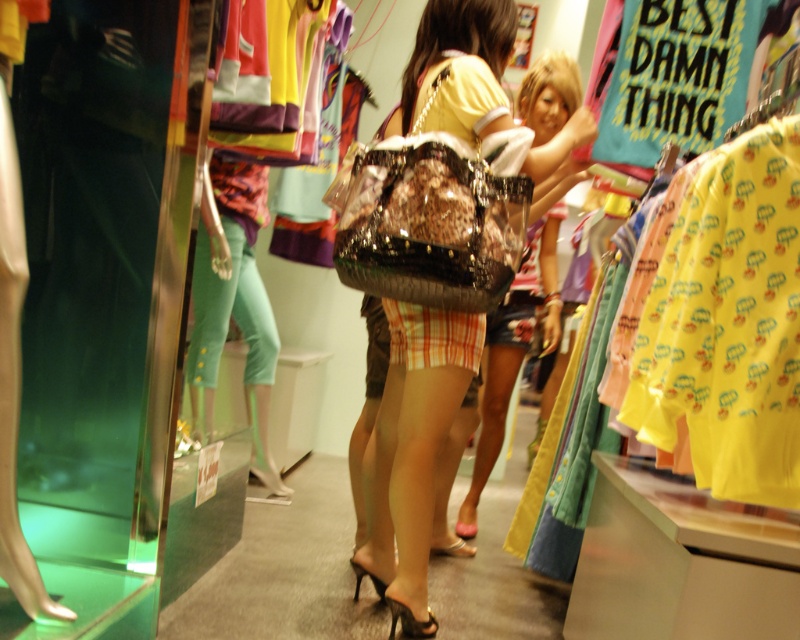
You are a customer in the store and want to see the shiny pink sandal at lower center. Is the plaid fabric skirt at center blocking your view of it?

The plaid fabric skirt at center is in front of the shiny pink sandal at lower center, so it is blocking the view of the sandal.